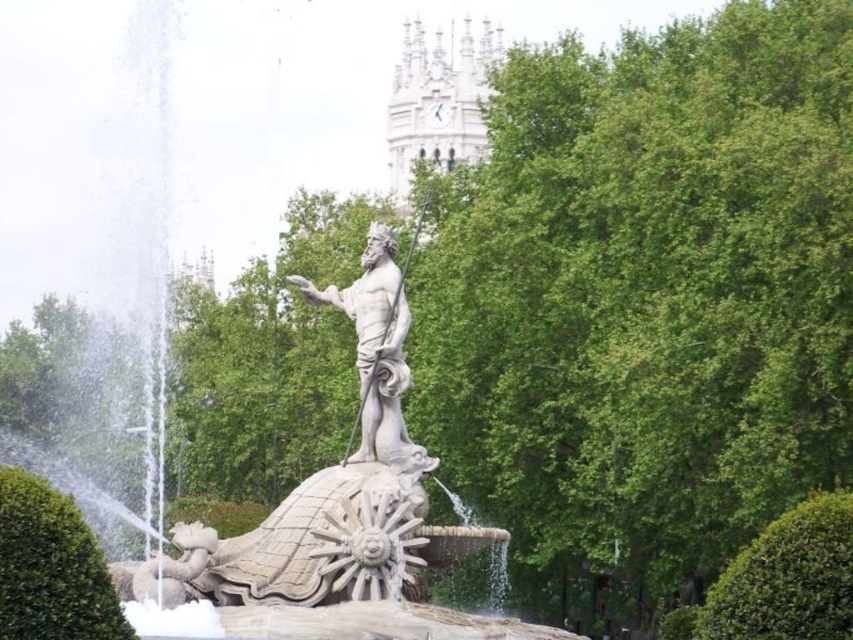
Between green leafy hedge at lower right and white stone clock tower at upper center, which one has less height?

green leafy hedge at lower right is shorter.

Which of these two, green leafy hedge at lower right or white stone clock tower at upper center, stands taller?

white stone clock tower at upper center

This screenshot has width=853, height=640. I want to click on green leafy hedge at lower right, so click(781, 580).

Which is in front, point (795, 637) or point (386, 408)?

Point (795, 637) is more forward.

The width and height of the screenshot is (853, 640). What do you see at coordinates (781, 580) in the screenshot? I see `green leafy hedge at lower right` at bounding box center [781, 580].

Identify the location of green leafy hedge at lower right. (781, 580).

Can you confirm if green leafy hedge at lower right is shorter than green leafy hedge at left?

Incorrect, green leafy hedge at lower right's height does not fall short of green leafy hedge at left's.

Does point (682, 618) come behind point (4, 538)?

That is True.

The height and width of the screenshot is (640, 853). I want to click on green leafy hedge at lower right, so click(781, 580).